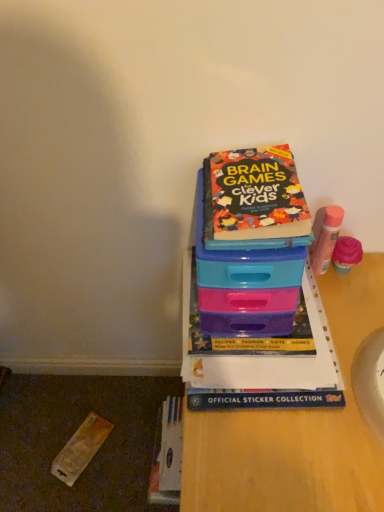
You are a GUI agent. You are given a task and a screenshot of the screen. Output one action in this format:
    pyautogui.click(x=<x>, y=<y>)
    Task: Click on the plastic at center
    
    Given the screenshot: What is the action you would take?
    pyautogui.click(x=296, y=430)

You are a GUI agent. You are given a task and a screenshot of the screen. Output one action in this format:
    pyautogui.click(x=<x>, y=<y>)
    Task: Click on the hardcover book at center, arranged as the 2th book when viewed from the top
    This screenshot has height=512, width=384.
    Given the screenshot: What is the action you would take?
    pyautogui.click(x=255, y=328)

Where is `plastic at center`? This screenshot has height=512, width=384. plastic at center is located at coordinates (296, 430).

Does point (260, 205) come closer to viewer compared to point (225, 328)?

Yes, point (260, 205) is closer to viewer.

Which object is positioned more to the left, multicolored paper book at upper center, the second book ordered from the bottom, or hardcover book at center, arranged as the 2th book when viewed from the top?

multicolored paper book at upper center, the second book ordered from the bottom.

From a real-world perspective, between multicolored paper book at upper center, the second book ordered from the bottom, and hardcover book at center, arranged as the 1th book when ordered from the bottom, who is vertically higher?

multicolored paper book at upper center, the second book ordered from the bottom, from a real-world perspective.

From a real-world perspective, is plastic at center above or below multicolored paper book at upper center, the second book ordered from the bottom?

In terms of real-world spatial position, plastic at center is below multicolored paper book at upper center, the second book ordered from the bottom.

Looking at this image, which point is more forward, (376, 504) or (303, 199)?

Positioned in front is point (376, 504).

Considering the sizes of objects plastic at center and multicolored paper book at upper center, the 1th book when ordered from top to bottom, in the image provided, who is shorter, plastic at center or multicolored paper book at upper center, the 1th book when ordered from top to bottom,?

With less height is multicolored paper book at upper center, the 1th book when ordered from top to bottom.

Locate an element on the screen. This screenshot has width=384, height=512. the 2nd book located above the plastic at center (from a real-world perspective) is located at coordinates (254, 201).

From the image's perspective, is hardcover book at center, arranged as the 2th book when viewed from the top, over plastic at center?

Yes, from the image's perspective, hardcover book at center, arranged as the 2th book when viewed from the top, is above plastic at center.

Which is in front, hardcover book at center, arranged as the 1th book when ordered from the bottom, or plastic at center?

plastic at center is in front.

Which of these two, hardcover book at center, arranged as the 2th book when viewed from the top, or plastic at center, is thinner?

hardcover book at center, arranged as the 2th book when viewed from the top.

How many degrees apart are the facing directions of hardcover book at center, arranged as the 1th book when ordered from the bottom, and plastic at center?

They differ by 1.19 degrees in their facing directions.

From the image's perspective, is multicolored paper book at upper center, the second book ordered from the bottom, located above or below plastic at center?

multicolored paper book at upper center, the second book ordered from the bottom, is above plastic at center.

Do you think multicolored paper book at upper center, the second book ordered from the bottom, is within plastic at center, or outside of it?

multicolored paper book at upper center, the second book ordered from the bottom, exists outside the volume of plastic at center.

Measure the distance from multicolored paper book at upper center, the second book ordered from the bottom, to plastic at center.

multicolored paper book at upper center, the second book ordered from the bottom, and plastic at center are 11.57 inches apart from each other.

Is multicolored paper book at upper center, the 1th book when ordered from top to bottom, thinner than plastic at center?

Correct, the width of multicolored paper book at upper center, the 1th book when ordered from top to bottom, is less than that of plastic at center.

Could hardcover book at center, arranged as the 1th book when ordered from the bottom, be considered to be inside plastic at center?

Yes, hardcover book at center, arranged as the 1th book when ordered from the bottom, is surrounded by plastic at center.

From a real-world perspective, between plastic at center and hardcover book at center, arranged as the 2th book when viewed from the top, who is vertically higher?

hardcover book at center, arranged as the 2th book when viewed from the top, is physically above.

Between plastic at center and hardcover book at center, arranged as the 2th book when viewed from the top, which one has larger size?

plastic at center.

From a real-world perspective, which object rests below the other?

hardcover book at center, arranged as the 2th book when viewed from the top, is physically lower.

Is hardcover book at center, arranged as the 1th book when ordered from the bottom, not near multicolored paper book at upper center, the second book ordered from the bottom?

No, hardcover book at center, arranged as the 1th book when ordered from the bottom, is in close proximity to multicolored paper book at upper center, the second book ordered from the bottom.

Would you say hardcover book at center, arranged as the 1th book when ordered from the bottom, is to the left or to the right of multicolored paper book at upper center, the 1th book when ordered from top to bottom, in the picture?

hardcover book at center, arranged as the 1th book when ordered from the bottom, is to the right of multicolored paper book at upper center, the 1th book when ordered from top to bottom.

How many degrees apart are the facing directions of hardcover book at center, arranged as the 1th book when ordered from the bottom, and multicolored paper book at upper center, the second book ordered from the bottom?

They differ by 0.00115 degrees in their facing directions.

At what (x,y) coordinates should I click in order to perform the action: click on book above the hardcover book at center, arranged as the 1th book when ordered from the bottom (from a real-world perspective). Please return your answer as a coordinate pair (x, y). The width and height of the screenshot is (384, 512). Looking at the image, I should click on (254, 201).

Find the location of a particular element. Image resolution: width=384 pixels, height=512 pixels. the 1st book behind the plastic at center is located at coordinates (254, 201).

From the image, which object appears to be nearer to hardcover book at center, arranged as the 2th book when viewed from the top, plastic at center or multicolored paper book at upper center, the 1th book when ordered from top to bottom?

The object closer to hardcover book at center, arranged as the 2th book when viewed from the top, is plastic at center.

From the image, which object appears to be nearer to hardcover book at center, arranged as the 2th book when viewed from the top, multicolored paper book at upper center, the 1th book when ordered from top to bottom, or plastic at center?

plastic at center.

From the image, which object appears to be nearer to multicolored paper book at upper center, the 1th book when ordered from top to bottom, plastic at center or hardcover book at center, arranged as the 2th book when viewed from the top?

Based on the image, hardcover book at center, arranged as the 2th book when viewed from the top, appears to be nearer to multicolored paper book at upper center, the 1th book when ordered from top to bottom.

From the image, which object appears to be farther from multicolored paper book at upper center, the 1th book when ordered from top to bottom, hardcover book at center, arranged as the 2th book when viewed from the top, or plastic at center?

plastic at center is positioned further to the anchor multicolored paper book at upper center, the 1th book when ordered from top to bottom.

Looking at the image, which one is located closer to plastic at center, multicolored paper book at upper center, the 1th book when ordered from top to bottom, or hardcover book at center, arranged as the 1th book when ordered from the bottom?

Among the two, hardcover book at center, arranged as the 1th book when ordered from the bottom, is located nearer to plastic at center.

Based on the photo, based on their spatial positions, is hardcover book at center, arranged as the 2th book when viewed from the top, or multicolored paper book at upper center, the second book ordered from the bottom, closer to plastic at center?

The object closer to plastic at center is hardcover book at center, arranged as the 2th book when viewed from the top.

You are a GUI agent. You are given a task and a screenshot of the screen. Output one action in this format:
    pyautogui.click(x=<x>, y=<y>)
    Task: Click on the book between multicolored paper book at upper center, the 1th book when ordered from top to bottom, and plastic at center vertically
    This screenshot has height=512, width=384.
    Given the screenshot: What is the action you would take?
    pyautogui.click(x=255, y=328)